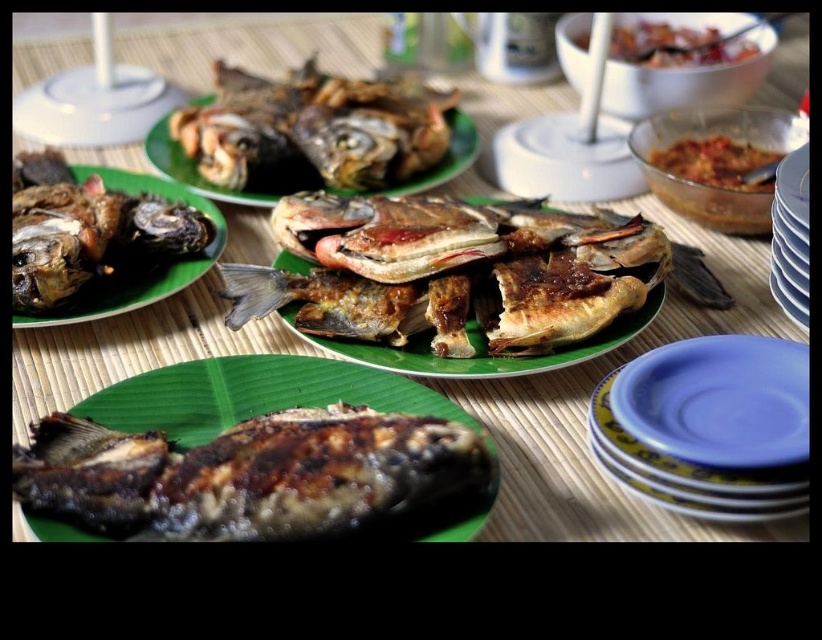
Is brown matte fish at left bigger than tomato paste at upper right?

Correct, brown matte fish at left is larger in size than tomato paste at upper right.

Is point (146, 291) farther from viewer compared to point (737, 186)?

No, it is in front of (737, 186).

Locate an element on the screen. The image size is (822, 640). brown matte fish at left is located at coordinates tap(149, 269).

Looking at this image, is brown crispy fish at center positioned behind brown matte fish at center?

No.

Is point (635, 301) less distant than point (469, 152)?

Yes, it is in front of point (469, 152).

This screenshot has height=640, width=822. Find the location of `brown crispy fish at center`. brown crispy fish at center is located at coordinates (450, 272).

Between brown crispy fish at center and blue glossy plate at lower right, which one is positioned lower?

blue glossy plate at lower right is lower down.

Can you confirm if brown crispy fish at center is wider than blue glossy plate at lower right?

Yes.

I want to click on brown crispy fish at center, so click(x=450, y=272).